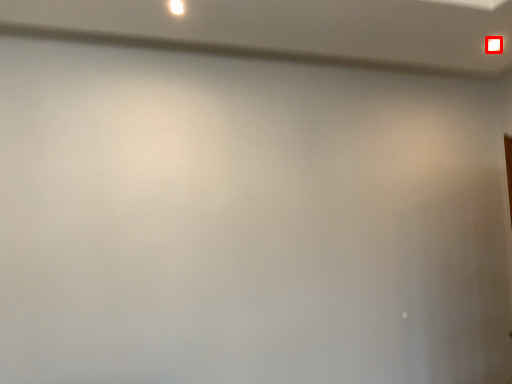
Question: In this image, where is light (annotated by the red box) located relative to light?

Choices:
 (A) left
 (B) right

Answer: (B)